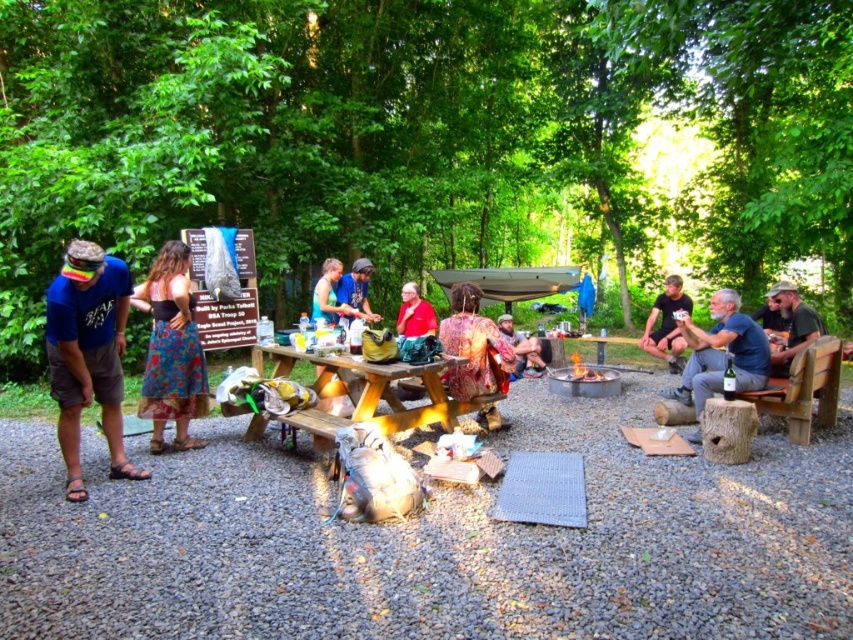
Question: Is camouflage fabric shirt at right above red fabric shirt at center?

Choices:
 (A) yes
 (B) no

Answer: (B)

Question: Which object is positioned farthest from the floral fabric skirt at center?

Choices:
 (A) flannel shirt at center
 (B) blue fabric shirt at left
 (C) red fabric shirt at center

Answer: (A)

Question: Can you confirm if floral fabric skirt at center is positioned to the left of denim jacket at center?

Choices:
 (A) yes
 (B) no

Answer: (A)

Question: Based on their relative distances, which object is nearer to the flannel shirt at center?

Choices:
 (A) blue fabric shirt at left
 (B) floral fabric skirt at center
 (C) camouflage fabric shirt at right

Answer: (C)

Question: Which of the following is the closest to the observer?

Choices:
 (A) floral fabric skirt at center
 (B) denim jacket at center
 (C) black t-shirt at right
 (D) blue denim jeans at lower right

Answer: (A)

Question: Is wooden picnic table at center behind flannel shirt at center?

Choices:
 (A) no
 (B) yes

Answer: (A)